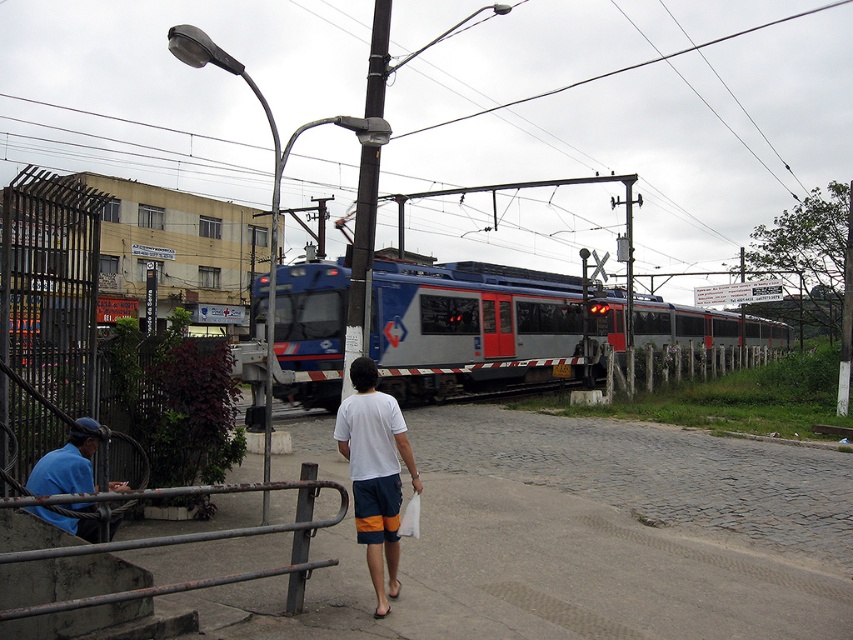
You are standing at the railway crossing and see the electric train passing by. There is a point marked at coordinates (200, 531). What object does this point represent?

The point at coordinates (200, 531) corresponds to the rusty metal rail at lower left.

You are a pedestrian standing at the railway crossing. You see the blue metallic train at center and the blue fabric shirt at lower left. Which object is bigger in size?

The blue metallic train at center is larger in size than the blue fabric shirt at lower left.

You are a pedestrian standing at the railway crossing and see the electric train passing by. There is a point marked at coordinates (375, 472). According to the scene, where is this point located?

The point marked at coordinates (375, 472) is located on the white cotton t shirt at center.